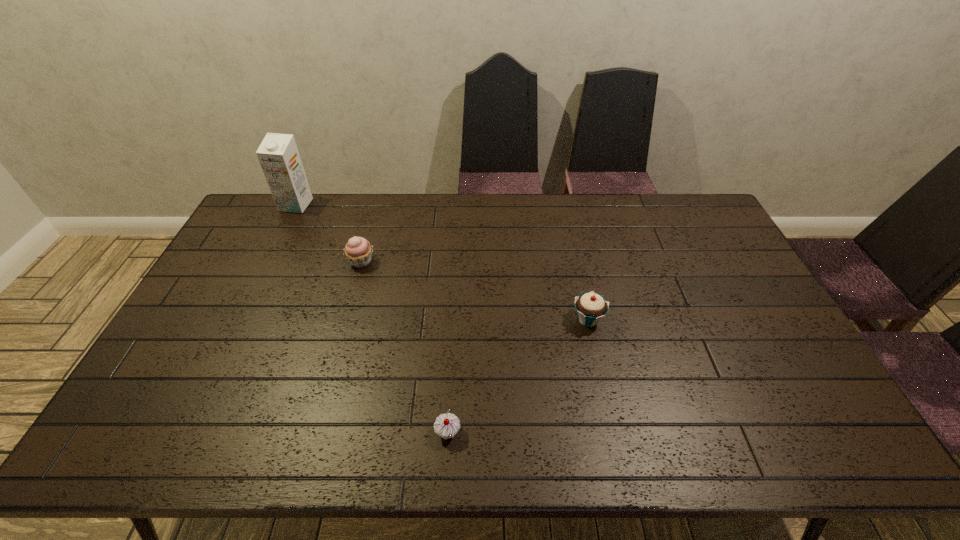
Identify the location of vacant space at the far left corner of the desktop. This screenshot has height=540, width=960. (258, 199).

In the image, there is a desktop. Where is `vacant space at the near left corner`? vacant space at the near left corner is located at coordinates (175, 454).

In the image, there is a desktop. Where is `vacant space at the far right corner`? vacant space at the far right corner is located at coordinates (709, 219).

You are a GUI agent. You are given a task and a screenshot of the screen. Output one action in this format:
    pyautogui.click(x=<x>, y=<y>)
    Task: Click on the empty location between the farthest cupcake and the nearest object
    Image resolution: width=960 pixels, height=540 pixels.
    Given the screenshot: What is the action you would take?
    404,347

I want to click on free point between the leftmost object and the nearest object, so click(x=372, y=319).

Find the location of a particular element. This screenshot has width=960, height=540. free space that is in between the leftmost cupcake and the second object from right to left is located at coordinates (404, 347).

Locate an element on the screen. The image size is (960, 540). free area in between the leftmost object and the leftmost cupcake is located at coordinates 328,233.

You are a GUI agent. You are given a task and a screenshot of the screen. Output one action in this format:
    pyautogui.click(x=<x>, y=<y>)
    Task: Click on the free space between the third object from left to right and the leftmost cupcake
    
    Given the screenshot: What is the action you would take?
    pyautogui.click(x=404, y=347)

Identify the location of free spot between the nearest cupcake and the leftmost cupcake. (404, 347).

Locate an element on the screen. The width and height of the screenshot is (960, 540). empty space between the leftmost cupcake and the carton is located at coordinates (328, 233).